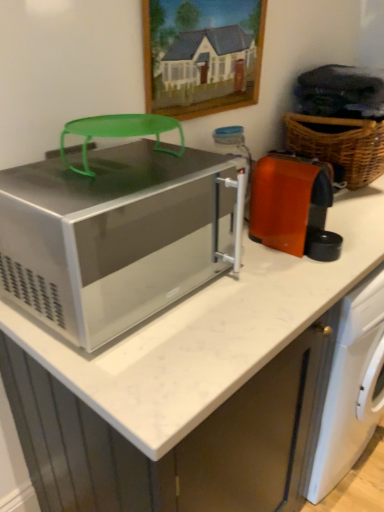
Question: Is satin silver microwave at center oriented away from woven brown basket at right?

Choices:
 (A) no
 (B) yes

Answer: (A)

Question: Is satin silver microwave at center to the left of woven brown basket at right from the viewer's perspective?

Choices:
 (A) yes
 (B) no

Answer: (A)

Question: Is satin silver microwave at center wider than woven brown basket at right?

Choices:
 (A) no
 (B) yes

Answer: (B)

Question: Is satin silver microwave at center next to woven brown basket at right and touching it?

Choices:
 (A) no
 (B) yes

Answer: (A)

Question: Is satin silver microwave at center at the right side of woven brown basket at right?

Choices:
 (A) yes
 (B) no

Answer: (B)

Question: Can you confirm if satin silver microwave at center is shorter than woven brown basket at right?

Choices:
 (A) yes
 (B) no

Answer: (A)

Question: Is satin silver microwave at center located within woven brown basket at right?

Choices:
 (A) yes
 (B) no

Answer: (B)

Question: Is the surface of woven brown basket at right in direct contact with satin silver microwave at center?

Choices:
 (A) no
 (B) yes

Answer: (A)

Question: Is woven brown basket at right at the right side of satin silver microwave at center?

Choices:
 (A) no
 (B) yes

Answer: (B)

Question: From a real-world perspective, is woven brown basket at right over satin silver microwave at center?

Choices:
 (A) yes
 (B) no

Answer: (A)

Question: Considering the relative sizes of woven brown basket at right and satin silver microwave at center in the image provided, is woven brown basket at right bigger than satin silver microwave at center?

Choices:
 (A) yes
 (B) no

Answer: (A)

Question: Is there a large distance between woven brown basket at right and satin silver microwave at center?

Choices:
 (A) yes
 (B) no

Answer: (B)

Question: Is woven brown basket at right looking in the opposite direction of white marble countertop at center?

Choices:
 (A) yes
 (B) no

Answer: (B)